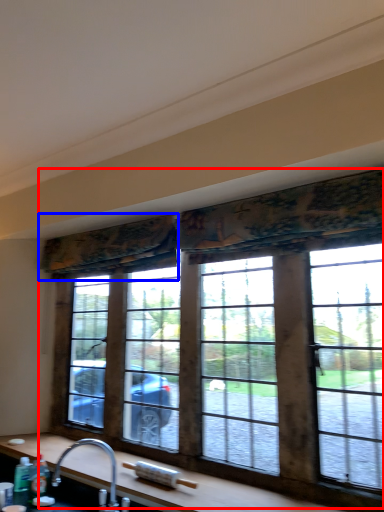
Question: Which point is closer to the camera, window (highlighted by a red box) or curtain (highlighted by a blue box)?

Choices:
 (A) window
 (B) curtain

Answer: (A)